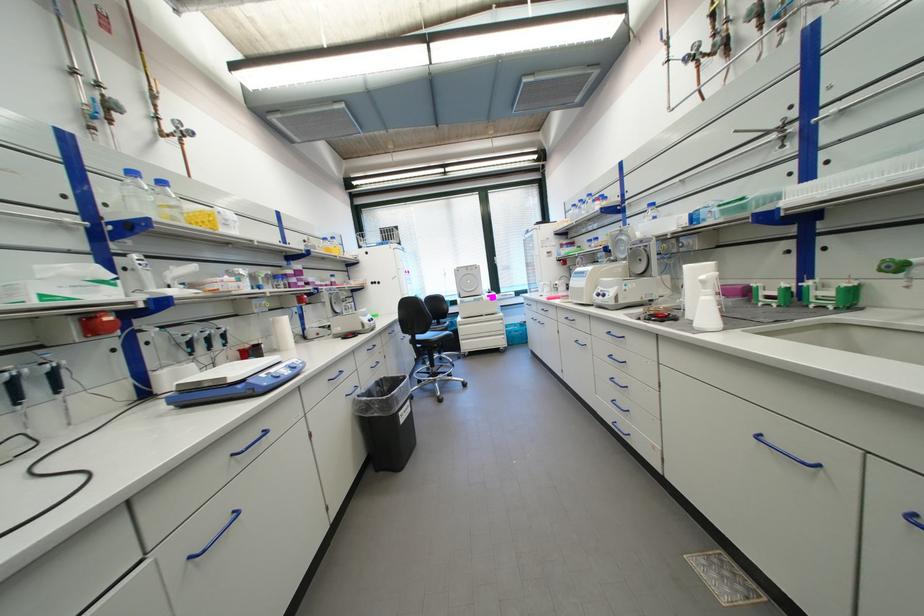
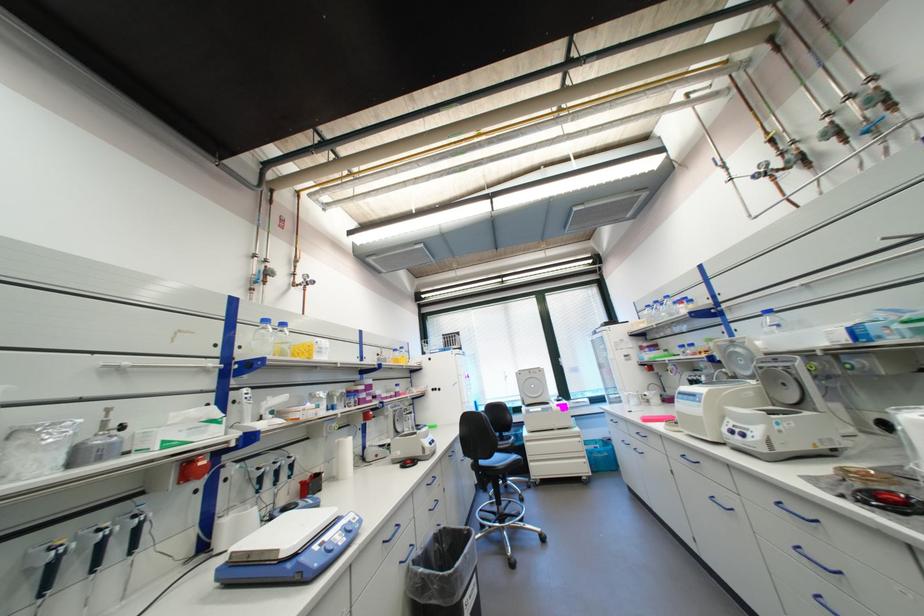
Where in the second image is the point corresponding to [184,208] from the first image?

(295, 344)